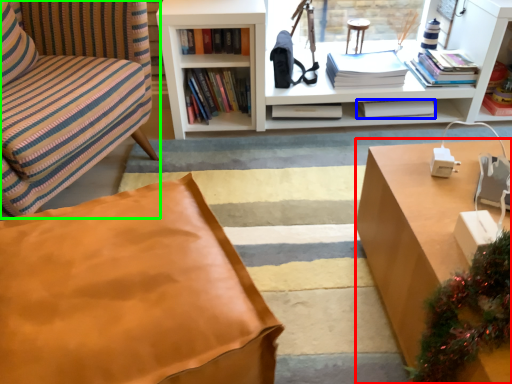
Question: Which object is positioned closest to desk (highlighted by a red box)? Select from book (highlighted by a blue box) and chair (highlighted by a green box).

Choices:
 (A) book
 (B) chair

Answer: (A)